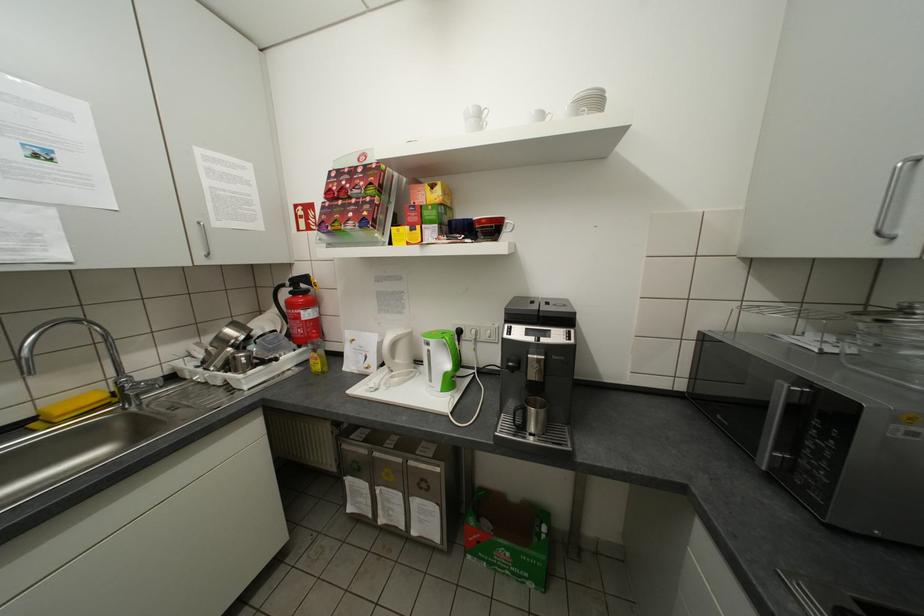
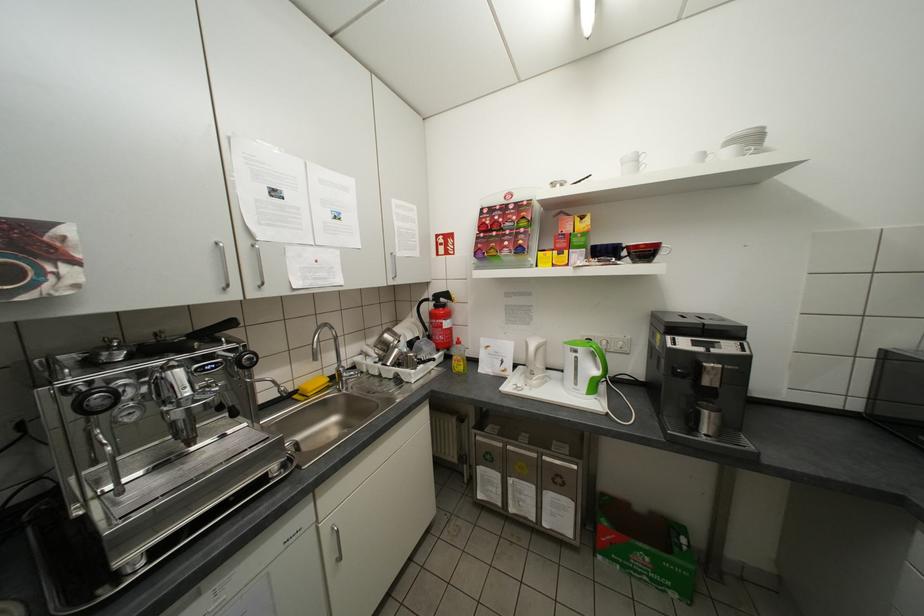
The point at (433, 344) is marked in the first image. Where is the corresponding point in the second image?

(579, 351)